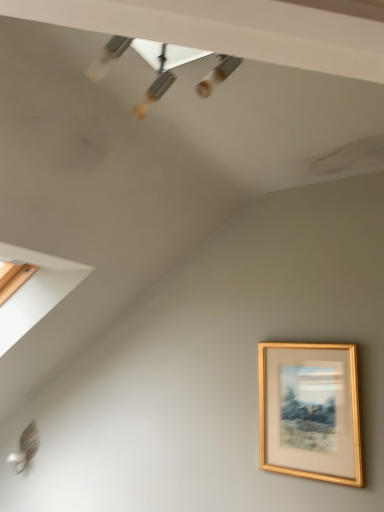
What do you see at coordinates (310, 411) in the screenshot?
I see `gold metallic picture frame at lower right` at bounding box center [310, 411].

This screenshot has height=512, width=384. What are the coordinates of `gold metallic picture frame at lower right` in the screenshot? It's located at (310, 411).

At what (x,y) coordinates should I click in order to perform the action: click on gold metallic picture frame at lower right. Please return your answer as a coordinate pair (x, y). This screenshot has height=512, width=384. Looking at the image, I should click on 310,411.